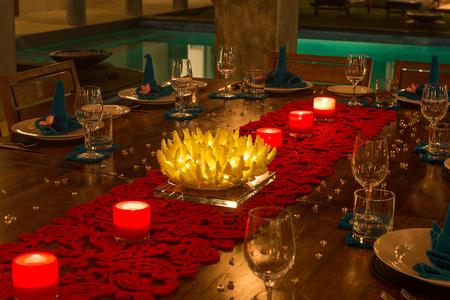
Locate an element on the screen. This screenshot has height=300, width=450. plate is located at coordinates (23, 133).